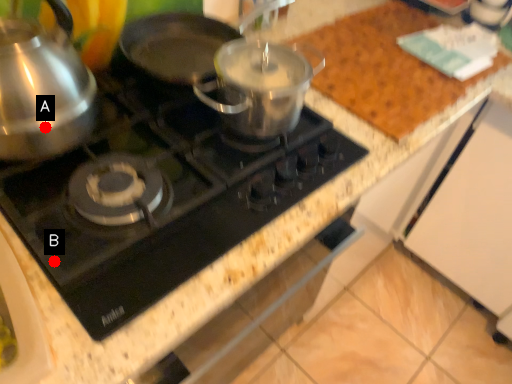
Question: Two points are circled on the image, labeled by A and B beside each circle. Which point is closer to the camera?

Choices:
 (A) A is closer
 (B) B is closer

Answer: (B)